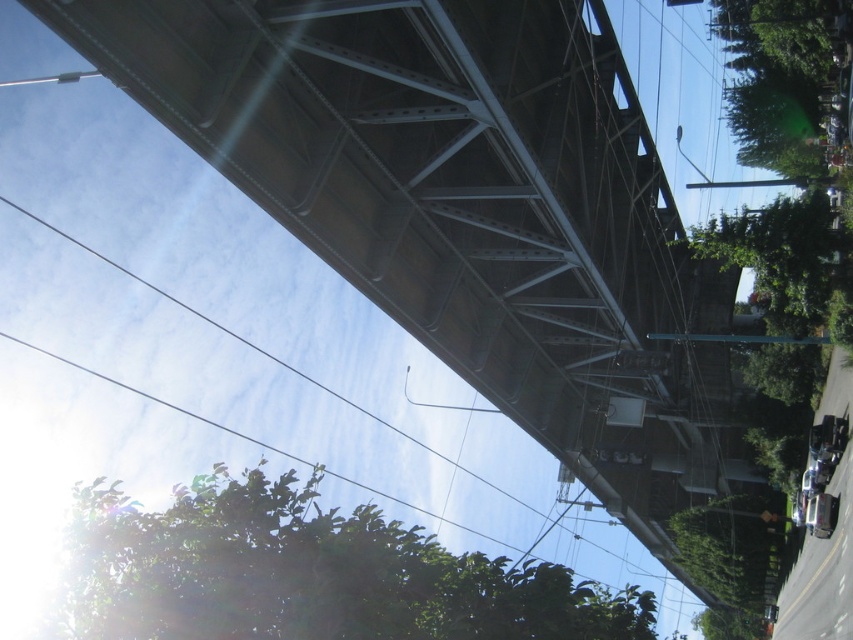
Question: Which point is closer to the camera taking this photo?

Choices:
 (A) (787, 518)
 (B) (820, 456)

Answer: (B)

Question: Which object appears closest to the camera in this image?

Choices:
 (A) shiny black car at lower right
 (B) green matte skateboard at lower right

Answer: (A)

Question: Which point is closer to the camera?

Choices:
 (A) (808, 467)
 (B) (782, 534)

Answer: (A)

Question: Considering the relative positions of shiny black car at lower right and green matte skateboard at lower right in the image provided, where is shiny black car at lower right located with respect to green matte skateboard at lower right?

Choices:
 (A) left
 (B) right

Answer: (A)

Question: Is shiny black car at lower right above green matte skateboard at lower right?

Choices:
 (A) yes
 (B) no

Answer: (A)

Question: Can you confirm if shiny black car at lower right is wider than green matte skateboard at lower right?

Choices:
 (A) no
 (B) yes

Answer: (B)